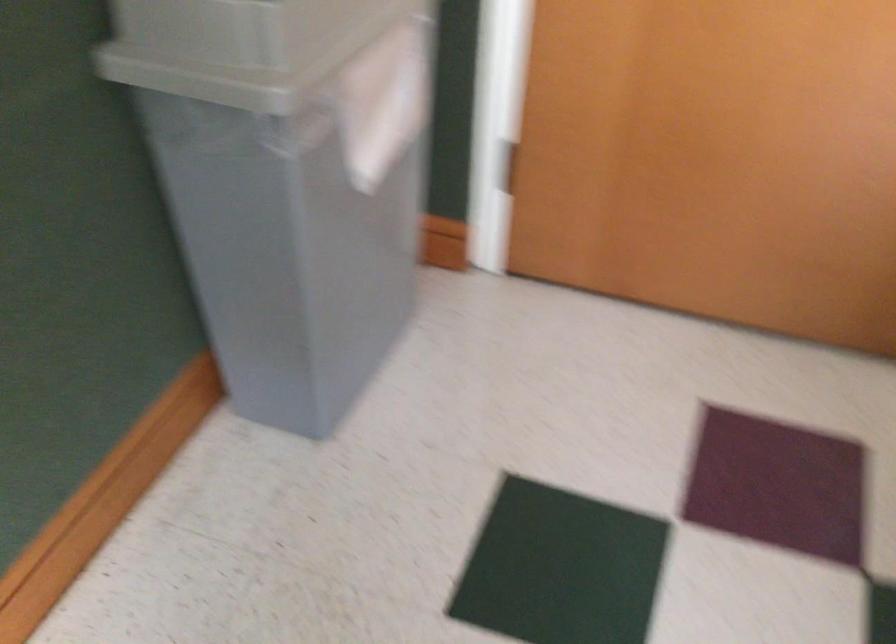
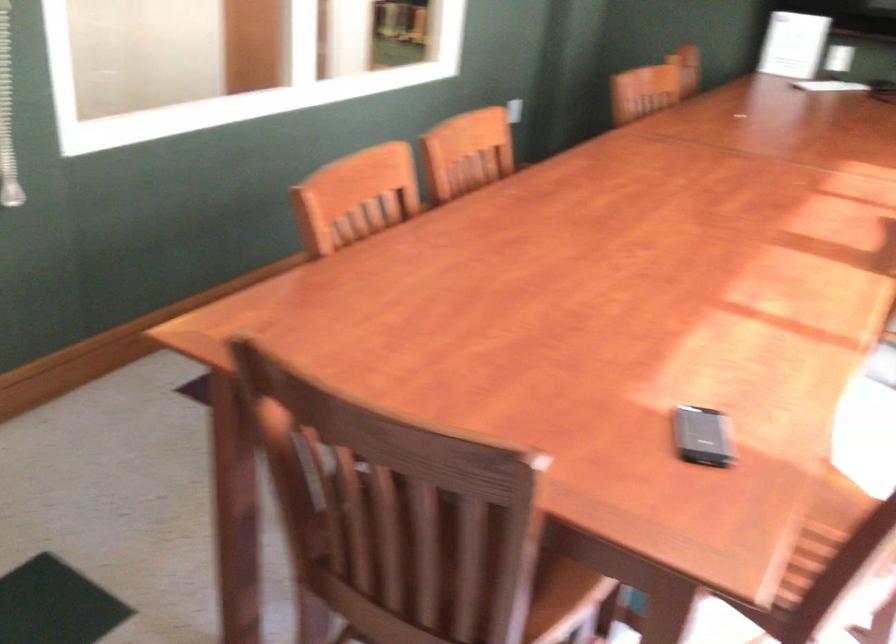
How did the camera likely rotate?

The rotation direction of the camera is right-down.